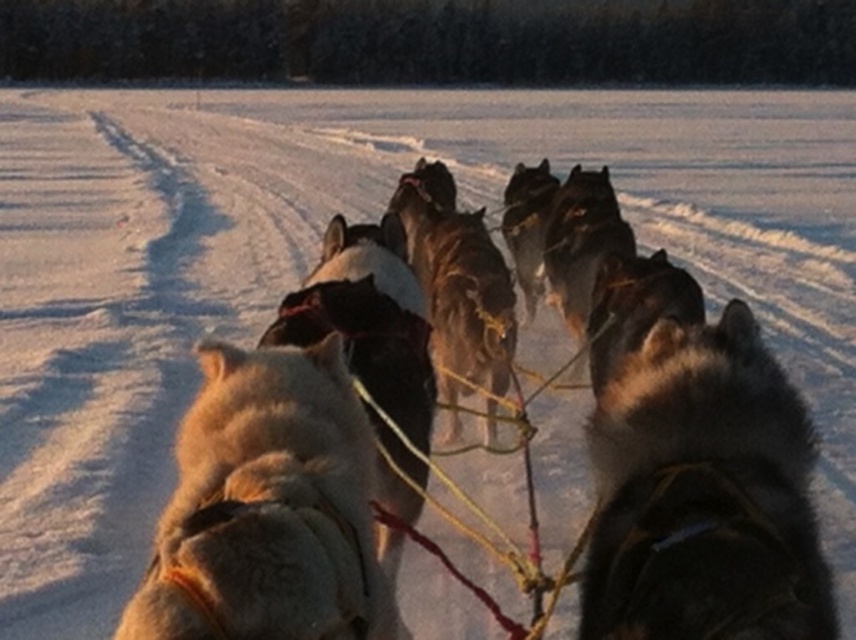
You are a photographer trying to capture the dog sled team. You notice two dogs at the center of the image, a black fur dog at center and a fuzzy white dog at center. Which dog appears smaller in the photo?

The black fur dog at center occupies less space than the fuzzy white dog at center, so the black fur dog at center appears smaller in the photo.

You are the musher guiding the dog sled team. You notice two points on the snowy path ahead. The first point is at coordinates point (730, 460) and the second is at point (212, 593). Which point is closer to your current position as you lead the sled forward?

Point (212, 593) is closer to your current position because it is ahead of point (730, 460), which is behind it.

You are a photographer trying to capture the lead dog of the sled team. The lead dog is the one furthest to the front. Based on the coordinates provided, is the dog represented by point (703, 493) the lead dog?

The black fur dog at center is represented by point (703, 493). Since the dogs are in a line facing forward with their bodies angled slightly towards the direction of motion, the lead dog would be the one furthest ahead. However, without additional information about the position of other dogs relative to this point, it is impossible to determine if this dog is the lead dog.